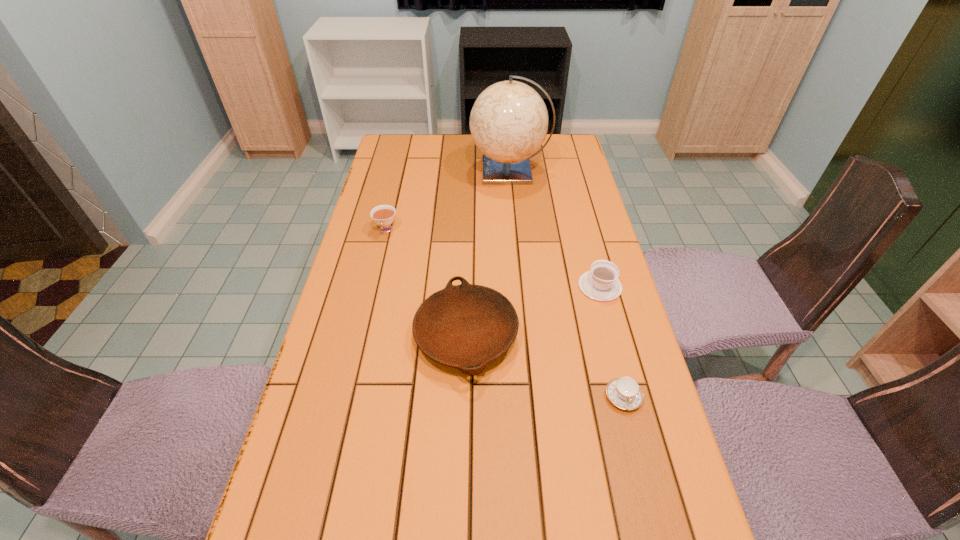
The height and width of the screenshot is (540, 960). What are the coordinates of `free space between the fourth nearest object and the second nearest teacup` in the screenshot? It's located at (493, 258).

The image size is (960, 540). I want to click on empty space between the second farthest teacup and the nearest teacup, so click(612, 341).

You are a GUI agent. You are given a task and a screenshot of the screen. Output one action in this format:
    pyautogui.click(x=<x>, y=<y>)
    Task: Click on the free space between the second farthest teacup and the plate
    
    Given the screenshot: What is the action you would take?
    tap(533, 310)

Identify which object is located as the nearest to the leftmost object. Please provide its 2D coordinates. Your answer should be formatted as a tuple, i.e. [(x, y)], where the tuple contains the x and y coordinates of a point satisfying the conditions above.

[(466, 326)]

The height and width of the screenshot is (540, 960). I want to click on object that is the third closest to the second farthest teacup, so click(509, 120).

Locate which teacup ranks second in proximity to the nearest teacup. Please provide its 2D coordinates. Your answer should be formatted as a tuple, i.e. [(x, y)], where the tuple contains the x and y coordinates of a point satisfying the conditions above.

[(383, 215)]

In order to click on teacup that is the second closest to the shortest teacup in this screenshot , I will do `click(383, 215)`.

Locate an element on the screen. vacant area in the image that satisfies the following two spatial constraints: 1. on the surface of the tallest object showing Europe and Africa; 2. on the side of the fourth nearest object with the handle is located at coordinates (515, 230).

The height and width of the screenshot is (540, 960). I want to click on vacant space that satisfies the following two spatial constraints: 1. on the side of the plate with the handle; 2. on the left side of the fourth nearest object, so click(x=361, y=335).

The image size is (960, 540). What are the coordinates of `free space that satisfies the following two spatial constraints: 1. on the surface of the globe showing Europe and Africa; 2. on the side of the leftmost object with the handle` in the screenshot? It's located at (515, 230).